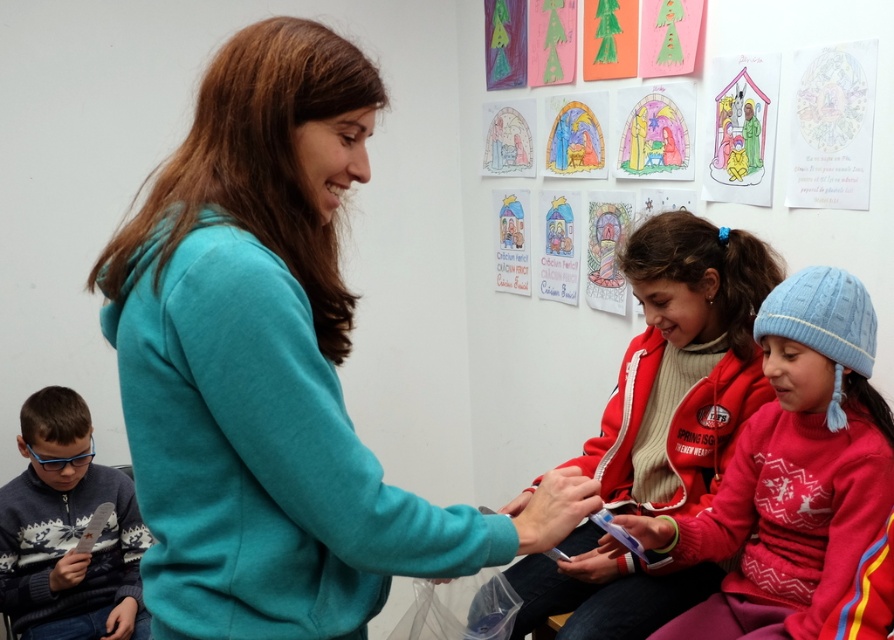
Describe the element at coordinates (271, 365) in the screenshot. I see `teal soft hoodie at center` at that location.

In the scene shown: Can you confirm if teal soft hoodie at center is shorter than red fleece jacket at center?

Indeed, teal soft hoodie at center has a lesser height compared to red fleece jacket at center.

In order to click on teal soft hoodie at center in this screenshot , I will do `click(271, 365)`.

Locate an element on the screen. Image resolution: width=894 pixels, height=640 pixels. teal soft hoodie at center is located at coordinates (271, 365).

Consider the image. Is red fleece jacket at center taller than blue knitted sweater at lower left?

Yes, red fleece jacket at center is taller than blue knitted sweater at lower left.

Does red fleece jacket at center have a lesser width compared to blue knitted sweater at lower left?

No.

Where is `red fleece jacket at center`? Image resolution: width=894 pixels, height=640 pixels. red fleece jacket at center is located at coordinates (682, 364).

This screenshot has width=894, height=640. In order to click on red fleece jacket at center in this screenshot , I will do click(682, 364).

Is red fleece jacket at center shorter than red knit sweater at center?

In fact, red fleece jacket at center may be taller than red knit sweater at center.

Can you confirm if red fleece jacket at center is wider than red knit sweater at center?

Indeed, red fleece jacket at center has a greater width compared to red knit sweater at center.

Where is `red fleece jacket at center`? red fleece jacket at center is located at coordinates (682, 364).